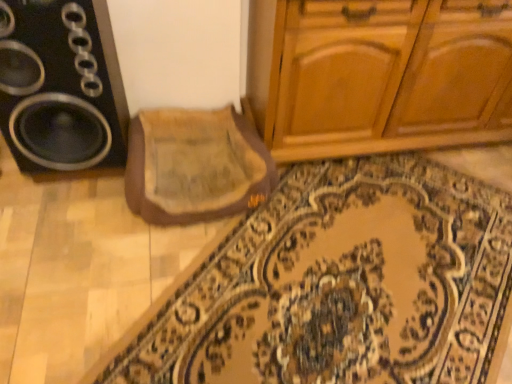
Question: Is black plastic speaker at left beside beige fabric mat at center?

Choices:
 (A) yes
 (B) no

Answer: (B)

Question: Is black plastic speaker at left facing towards beige fabric mat at center?

Choices:
 (A) yes
 (B) no

Answer: (B)

Question: From the image's perspective, is black plastic speaker at left located above beige fabric mat at center?

Choices:
 (A) no
 (B) yes

Answer: (B)

Question: Does black plastic speaker at left have a larger size compared to beige fabric mat at center?

Choices:
 (A) yes
 (B) no

Answer: (A)

Question: Could beige fabric mat at center be considered to be inside black plastic speaker at left?

Choices:
 (A) no
 (B) yes

Answer: (A)

Question: Looking at their shapes, would you say black plastic speaker at left is wider or thinner than carpeted mat at center?

Choices:
 (A) thin
 (B) wide

Answer: (A)

Question: Relative to carpeted mat at center, is black plastic speaker at left in front or behind?

Choices:
 (A) front
 (B) behind

Answer: (B)

Question: Which is correct: black plastic speaker at left is inside carpeted mat at center, or outside of it?

Choices:
 (A) outside
 (B) inside

Answer: (A)

Question: From the image's perspective, is black plastic speaker at left located above or below carpeted mat at center?

Choices:
 (A) above
 (B) below

Answer: (A)

Question: Is beige fabric mat at center in front of or behind carpeted mat at center in the image?

Choices:
 (A) behind
 (B) front

Answer: (A)

Question: In terms of height, does beige fabric mat at center look taller or shorter compared to carpeted mat at center?

Choices:
 (A) short
 (B) tall

Answer: (B)

Question: From a real-world perspective, is beige fabric mat at center above or below carpeted mat at center?

Choices:
 (A) below
 (B) above

Answer: (B)

Question: Considering the positions of beige fabric mat at center and carpeted mat at center in the image, is beige fabric mat at center wider or thinner than carpeted mat at center?

Choices:
 (A) thin
 (B) wide

Answer: (A)

Question: Relative to black plastic speaker at left, is beige fabric mat at center in front or behind?

Choices:
 (A) front
 (B) behind

Answer: (B)

Question: Considering the positions of beige fabric mat at center and black plastic speaker at left in the image, is beige fabric mat at center taller or shorter than black plastic speaker at left?

Choices:
 (A) tall
 (B) short

Answer: (B)